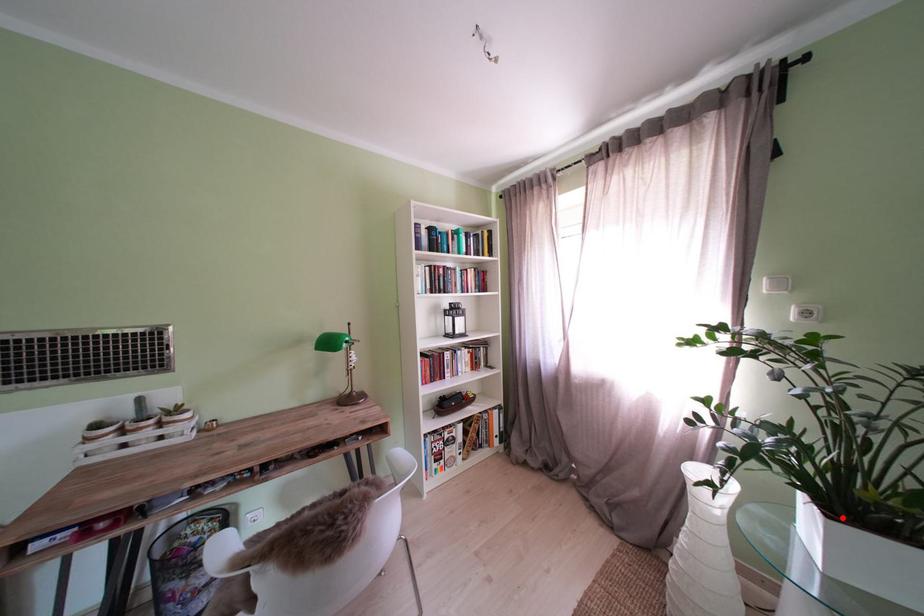
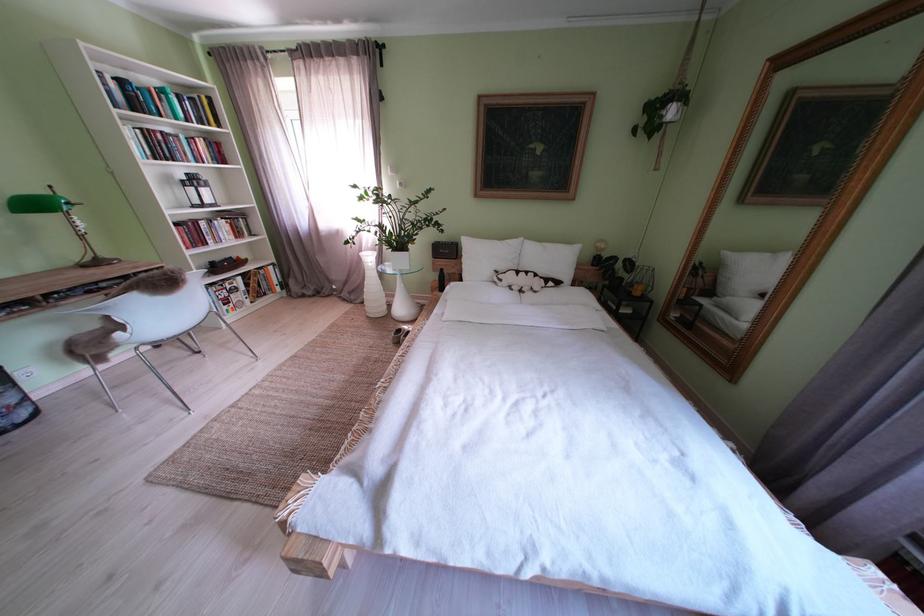
In the second image, find the point that corresponds to the highlighted location in the first image.

(405, 256)